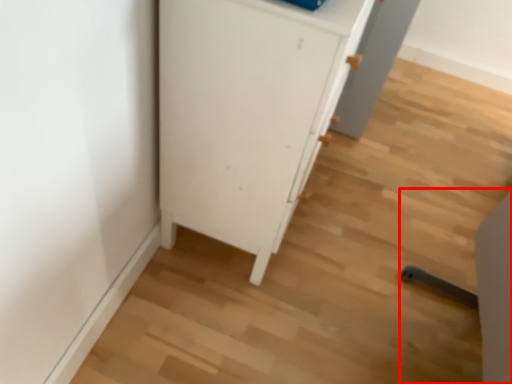
Question: From the image's perspective, what is the correct spatial relationship of chair (annotated by the red box) in relation to cupboard?

Choices:
 (A) below
 (B) above

Answer: (A)